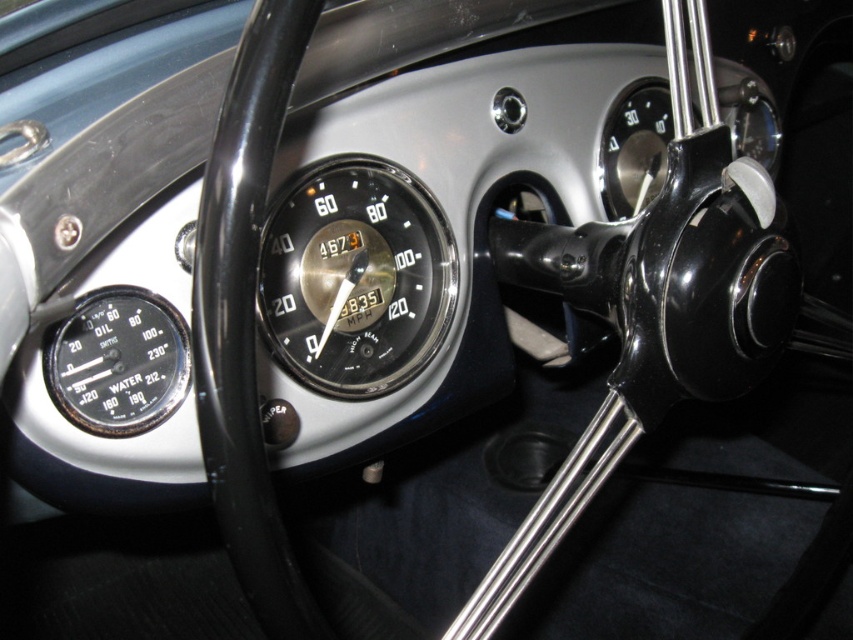
You are a mechanic checking the dashboard of a vintage car. You need to replace the shiny chrome speedometer at center and the black metallic gauge at left. Which object requires a wider replacement part?

The shiny chrome speedometer at center requires a wider replacement part because its width surpasses that of the black metallic gauge at left.

You are a mechanic inspecting the dashboard of a vintage car. You need to determine if the shiny chrome speedometer at center will fit into a storage box designed for gauges no taller than the black metallic gauge at left. Can it fit?

The shiny chrome speedometer at center is taller than the black metallic gauge at left, so it will not fit into the storage box designed for gauges no taller than the black metallic gauge at left.

You are a mechanic inspecting a vintage car. You need to adjust the shiny chrome speedometer at center. If your tool requires a minimum of 30 inches of clearance to operate, do you have enough space?

The shiny chrome speedometer at center is 32.76 inches away from camera, which is more than the required 30 inches clearance. Therefore, you have sufficient space to adjust the shiny chrome speedometer at center.